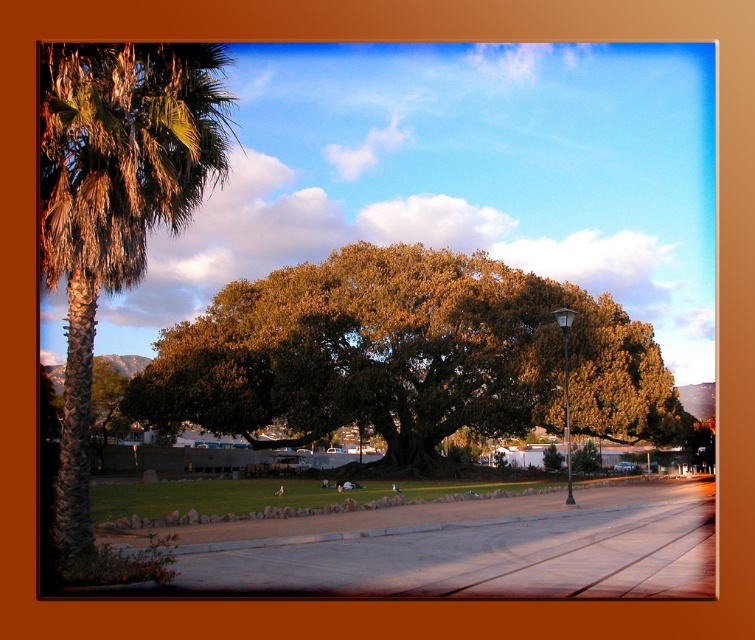
You are standing at the center of the image and want to walk towards the green leafy oak at center. Which direction should you go?

The green leafy oak at center is already at the center of the image, so you are already facing it. You don

You are standing at the point marked by the coordinates (405, 356) in the scene. What object are you directly positioned at?

The point marked by the coordinates (405, 356) is directly positioned at the green leafy oak at center.

You are planning to place a picnic blanket between the green leafy oak at center and the green leafy palm at left. Which tree has a wider canopy to provide more shade?

The green leafy oak at center has a wider canopy than the green leafy palm at left, so it provides more shade.